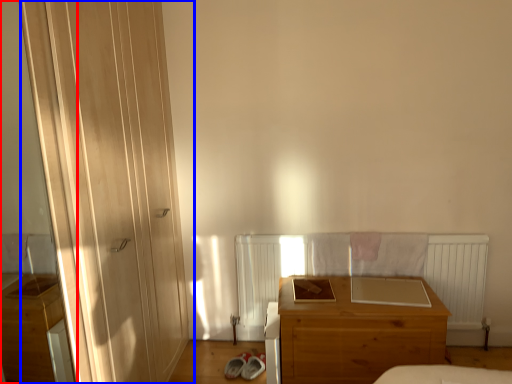
Question: Which of the following is the farthest to the observer, screen door (highlighted by a red box) or door (highlighted by a blue box)?

Choices:
 (A) screen door
 (B) door

Answer: (B)